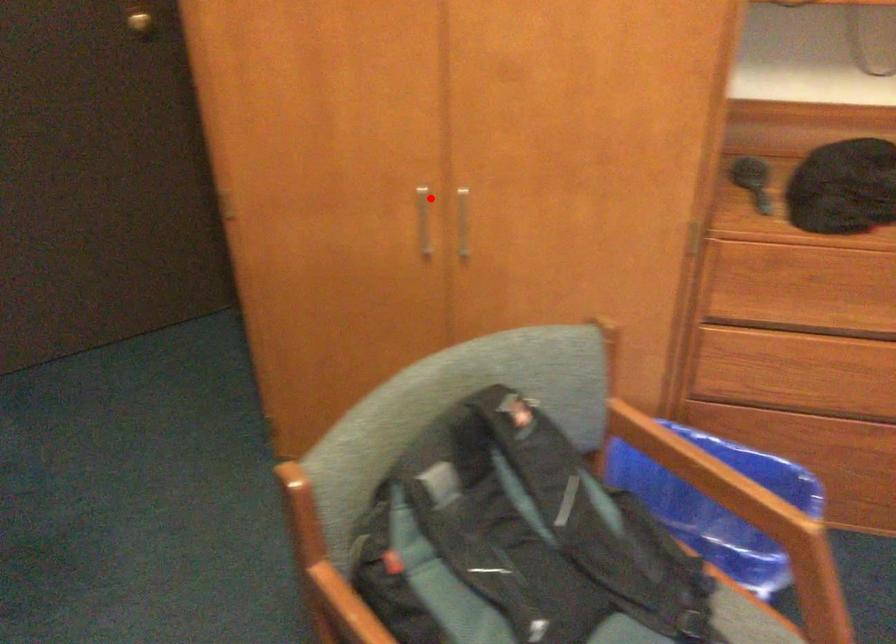
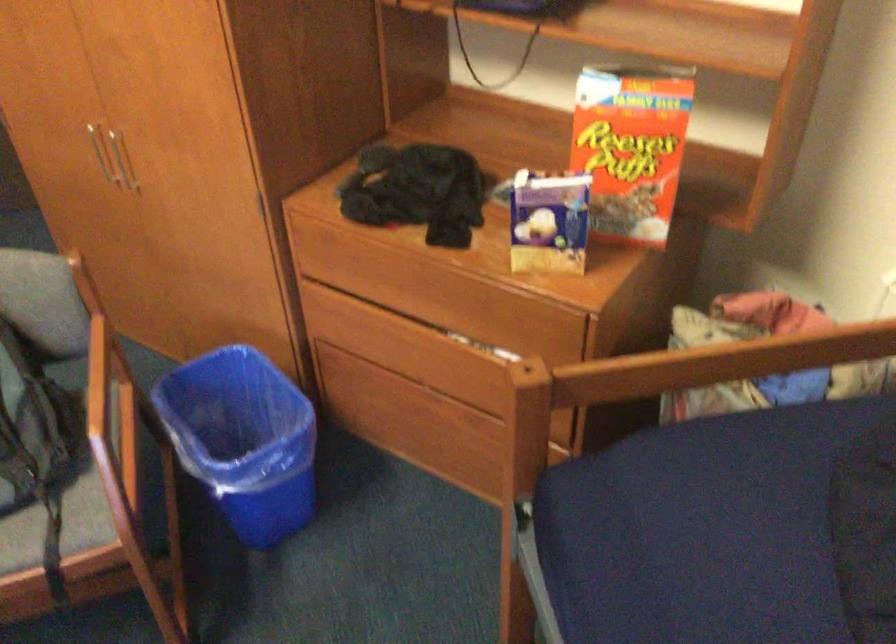
Question: I am providing you with two images of the same scene from different viewpoints. Image1 has a red point marked. In image2, the corresponding 3D location appears at what relative position? Reply with the corresponding letter.

Choices:
 (A) Closer
 (B) Farther

Answer: (B)